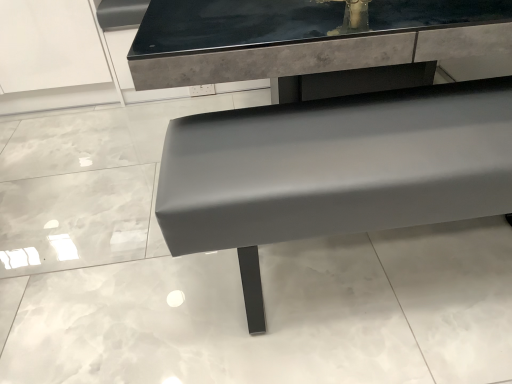
This screenshot has height=384, width=512. What do you see at coordinates (334, 170) in the screenshot?
I see `matte gray bench at center` at bounding box center [334, 170].

You are a GUI agent. You are given a task and a screenshot of the screen. Output one action in this format:
    pyautogui.click(x=<x>, y=<y>)
    Task: Click on the matte gray bench at center
    This screenshot has height=384, width=512.
    Given the screenshot: What is the action you would take?
    pyautogui.click(x=334, y=170)

Find the location of a particular element. matte gray bench at center is located at coordinates (334, 170).